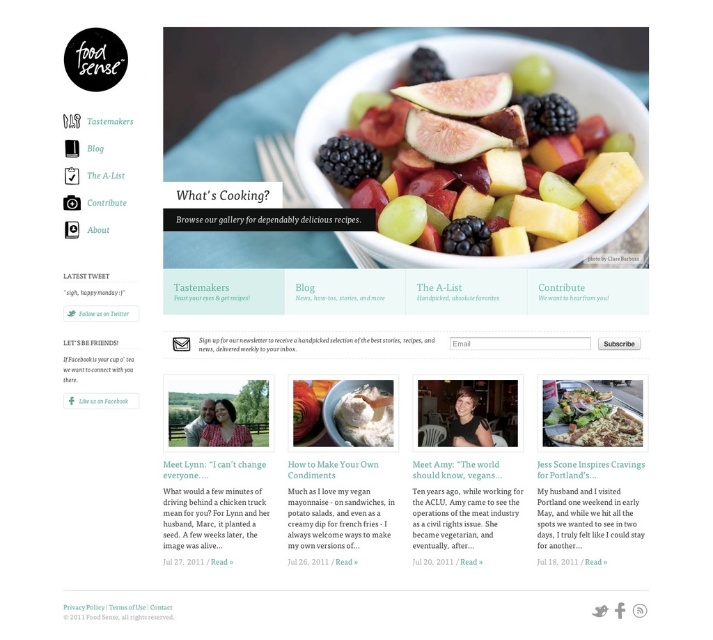
Question: Is green leafy salad at center smaller than white fluffy cloud at center?

Choices:
 (A) no
 (B) yes

Answer: (A)

Question: Which of the following is the farthest from the observer?

Choices:
 (A) (366, 433)
 (B) (588, 236)
 (C) (563, 417)

Answer: (A)

Question: Considering the relative positions of matte white bowl at center and white fluffy cloud at center in the image provided, where is matte white bowl at center located with respect to white fluffy cloud at center?

Choices:
 (A) left
 (B) right

Answer: (B)

Question: Which object is positioned closest to the matte white bowl at center?

Choices:
 (A) white fluffy cloud at center
 (B) green leafy salad at center

Answer: (B)

Question: Which object appears farthest from the camera in this image?

Choices:
 (A) matte white bowl at center
 (B) white fluffy cloud at center
 (C) green leafy salad at center

Answer: (B)

Question: Is matte white bowl at center wider than green leafy salad at center?

Choices:
 (A) no
 (B) yes

Answer: (B)